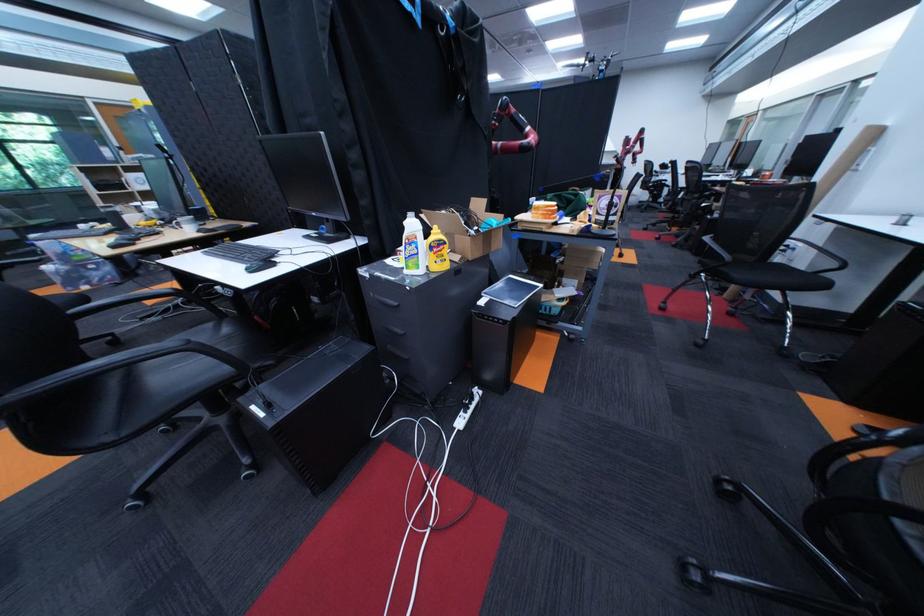
This screenshot has height=616, width=924. I want to click on PC power button, so click(x=504, y=379).